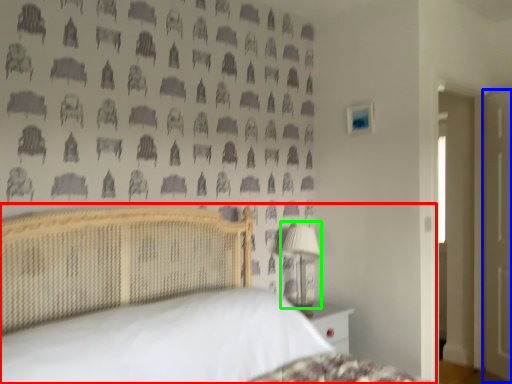
Question: Estimate the real-world distances between objects in this image. Which object is farther from bed (highlighted by a red box), door (highlighted by a blue box) or table lamp (highlighted by a green box)?

Choices:
 (A) door
 (B) table lamp

Answer: (A)